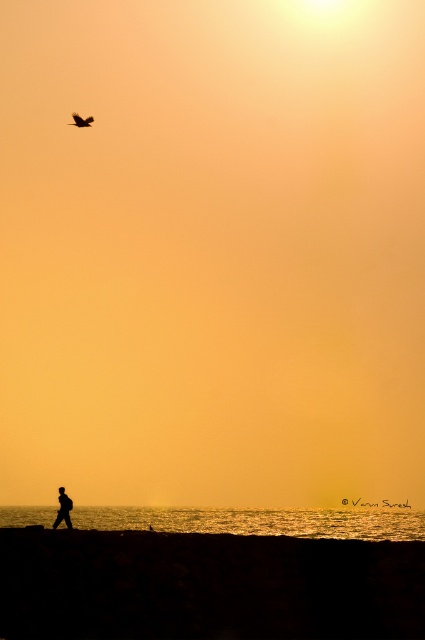
You are a photographer trying to capture the sunset scene. You notice the black silhouette person at lower left and the dark brown feathers at upper left. Which object in the scene is wider?

The black silhouette person at lower left is wider than the dark brown feathers at upper left.

Looking at this image, you are a photographer aiming to capture the sunset scene. You notice the black silhouette person at lower left and the dark brown feathers at upper left in your viewfinder. Based on their positions, which object would you adjust your camera to focus on first if you want to include both in the same frame without moving the camera?

The black silhouette person at lower left is located below the dark brown feathers at upper left. To include both in the same frame without moving the camera, you should focus on the dark brown feathers at upper left first since it is higher in the frame and adjusting focus upwards might help capture both elements within the depth of field.

You are standing on the rocky embankment and see the black silhouette person at lower left and the dark brown feathers at upper left. Which object is closer to your right side?

The black silhouette person at lower left is closer to your right side because it is positioned to the right of the dark brown feathers at upper left.